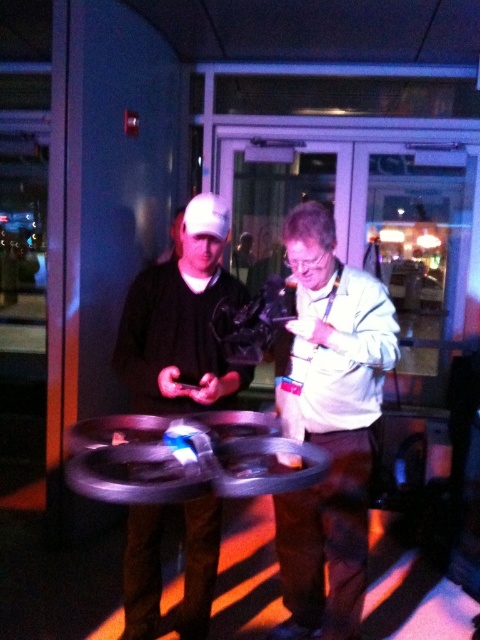
Question: Does white matte jacket at center lie behind matte black phone at center?

Choices:
 (A) no
 (B) yes

Answer: (A)

Question: Does white matte jacket at center lie behind matte black phone at center?

Choices:
 (A) yes
 (B) no

Answer: (B)

Question: Which of the following is the closest to the observer?

Choices:
 (A) (325, 278)
 (B) (191, 253)

Answer: (B)

Question: From the image, what is the correct spatial relationship of white matte jacket at center in relation to matte black phone at center?

Choices:
 (A) above
 (B) below

Answer: (B)